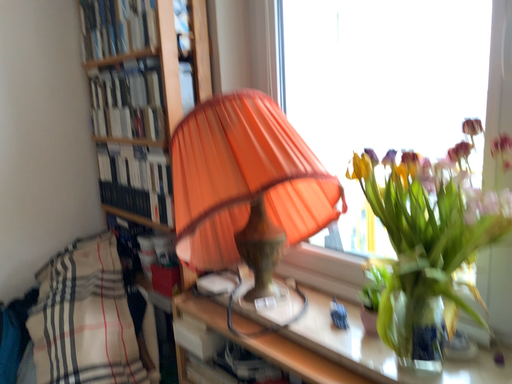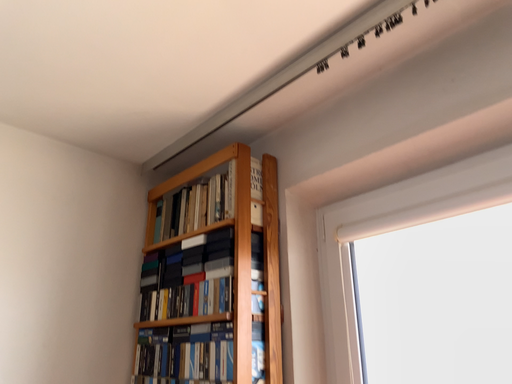
Question: Which way did the camera rotate in the video?

Choices:
 (A) rotated upward
 (B) rotated downward

Answer: (A)